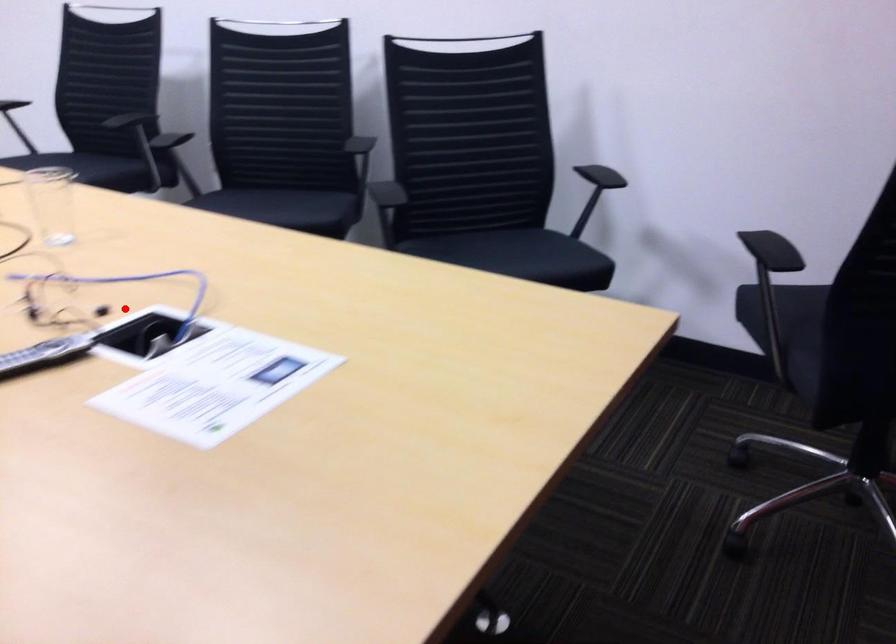
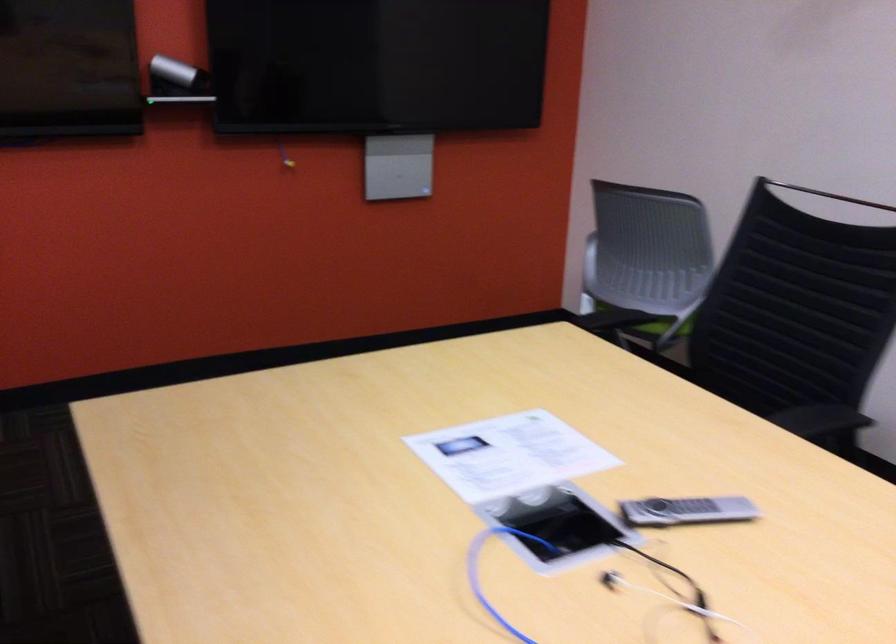
Question: I am providing you with two images of the same scene from different viewpoints. A red point is shown in image1. For the corresponding object point in image2, is it positioned nearer or farther from the camera?

Choices:
 (A) Nearer
 (B) Farther

Answer: (A)